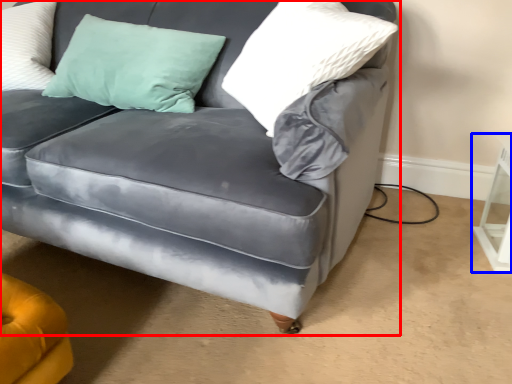
Question: Which of the following is the closest to the observer, studio couch (highlighted by a red box) or table (highlighted by a blue box)?

Choices:
 (A) studio couch
 (B) table

Answer: (A)